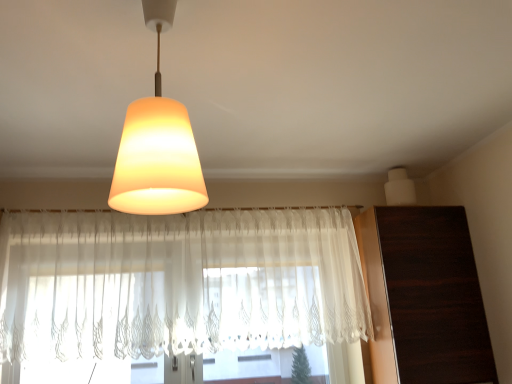
Question: Is white sheer curtain at center facing towards matte glass lampshade at upper center, marked as the second lamp in a right-to-left arrangement?

Choices:
 (A) yes
 (B) no

Answer: (A)

Question: Can you confirm if white sheer curtain at center is positioned to the right of matte glass lampshade at upper center, positioned as the 2th lamp in back-to-front order?

Choices:
 (A) yes
 (B) no

Answer: (B)

Question: From the image's perspective, is white sheer curtain at center above matte glass lampshade at upper center, arranged as the first lamp when viewed from the left?

Choices:
 (A) no
 (B) yes

Answer: (A)

Question: Does white sheer curtain at center have a lesser height compared to matte glass lampshade at upper center, positioned as the 2th lamp in back-to-front order?

Choices:
 (A) yes
 (B) no

Answer: (B)

Question: From a real-world perspective, is white sheer curtain at center located beneath matte glass lampshade at upper center, marked as the second lamp in a right-to-left arrangement?

Choices:
 (A) yes
 (B) no

Answer: (A)

Question: Visually, is white sheer curtain at center positioned to the left or to the right of matte glass lampshade at upper center, which is counted as the first lamp, starting from the front?

Choices:
 (A) left
 (B) right

Answer: (A)

Question: Is white sheer curtain at center bigger or smaller than matte glass lampshade at upper center, which is counted as the first lamp, starting from the front?

Choices:
 (A) small
 (B) big

Answer: (B)

Question: Would you say white sheer curtain at center is inside or outside matte glass lampshade at upper center, positioned as the 2th lamp in back-to-front order?

Choices:
 (A) inside
 (B) outside

Answer: (B)

Question: Is white sheer curtain at center wider or thinner than matte glass lampshade at upper center, which is counted as the first lamp, starting from the front?

Choices:
 (A) thin
 (B) wide

Answer: (A)

Question: Based on their positions, is matte glass lampshade at upper center, which is counted as the first lamp, starting from the front, located to the left or right of dark wood dresser at right?

Choices:
 (A) left
 (B) right

Answer: (A)

Question: Relative to dark wood dresser at right, is matte glass lampshade at upper center, arranged as the first lamp when viewed from the left, in front or behind?

Choices:
 (A) front
 (B) behind

Answer: (A)

Question: Is matte glass lampshade at upper center, marked as the second lamp in a right-to-left arrangement, taller or shorter than dark wood dresser at right?

Choices:
 (A) short
 (B) tall

Answer: (A)

Question: From the image's perspective, is matte glass lampshade at upper center, arranged as the first lamp when viewed from the left, above or below dark wood dresser at right?

Choices:
 (A) above
 (B) below

Answer: (A)

Question: Is point (460, 248) closer or farther from the camera than point (394, 178)?

Choices:
 (A) farther
 (B) closer

Answer: (B)

Question: Is dark wood dresser at right inside or outside of white matte speaker at upper right, acting as the 1th lamp starting from the right?

Choices:
 (A) outside
 (B) inside

Answer: (A)